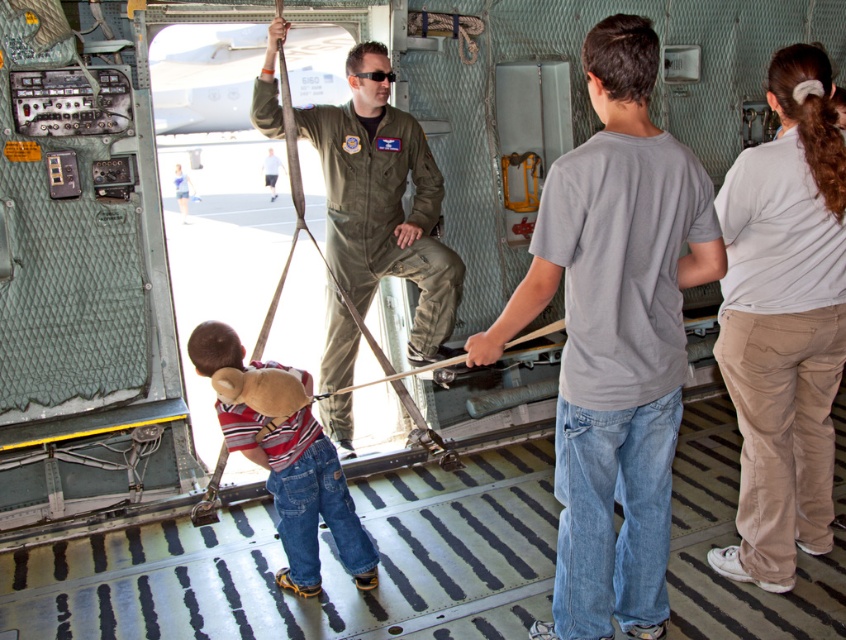
Question: Observing the image, what is the correct spatial positioning of white cotton shirt at upper right in reference to striped cotton shirt at center?

Choices:
 (A) left
 (B) right

Answer: (B)

Question: Which is farther from the green uniform at center?

Choices:
 (A) gray cotton shirt at center
 (B) white cotton shirt at upper right

Answer: (B)

Question: Estimate the real-world distances between objects in this image. Which object is closer to the striped cotton shirt at center?

Choices:
 (A) green uniform at center
 (B) gray cotton shirt at center

Answer: (B)

Question: In this image, where is white cotton shirt at upper right located relative to green uniform at center?

Choices:
 (A) right
 (B) left

Answer: (A)

Question: Can you confirm if gray cotton shirt at center is positioned to the left of white cotton shirt at upper right?

Choices:
 (A) yes
 (B) no

Answer: (A)

Question: Considering the real-world distances, which object is farthest from the green uniform at center?

Choices:
 (A) striped cotton shirt at center
 (B) white cotton shirt at upper right

Answer: (B)